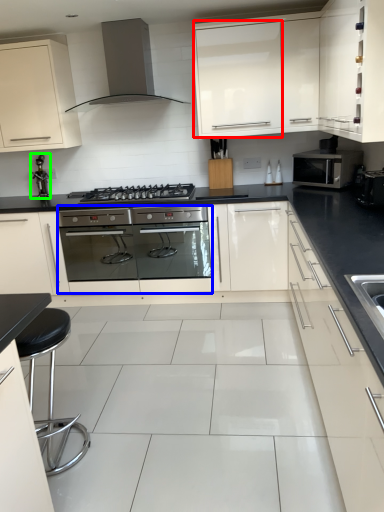
Question: Which is nearer to the glass door (highlighted by a red box)? oven (highlighted by a blue box) or faucet (highlighted by a green box).

Choices:
 (A) oven
 (B) faucet

Answer: (A)